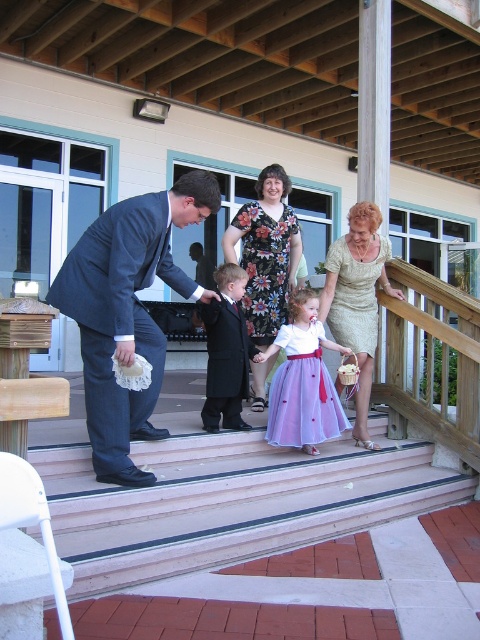
Question: Which object appears closest to the camera in this image?

Choices:
 (A) dark blue suit at center
 (B) matte black suit at left

Answer: (B)

Question: Among these points, which one is farthest from the camera?

Choices:
 (A) (307, 353)
 (B) (190, 192)

Answer: (A)

Question: Can you confirm if dark blue suit at center is thinner than matte black suit at center?

Choices:
 (A) yes
 (B) no

Answer: (B)

Question: Is lavender satin dress at center positioned behind gold textured dress at center?

Choices:
 (A) no
 (B) yes

Answer: (A)

Question: Can you confirm if lavender satin dress at center is smaller than matte black suit at center?

Choices:
 (A) no
 (B) yes

Answer: (B)

Question: Which object is positioned farthest from the floral-patterned fabric dress at center?

Choices:
 (A) gold sequined dress at center
 (B) smooth concrete stairs at center
 (C) matte black suit at left

Answer: (B)